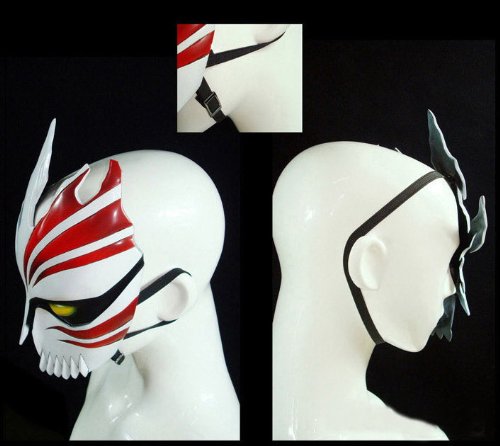
Image resolution: width=500 pixels, height=446 pixels. I want to click on maniquin, so click(167, 196), click(321, 199), click(282, 68).